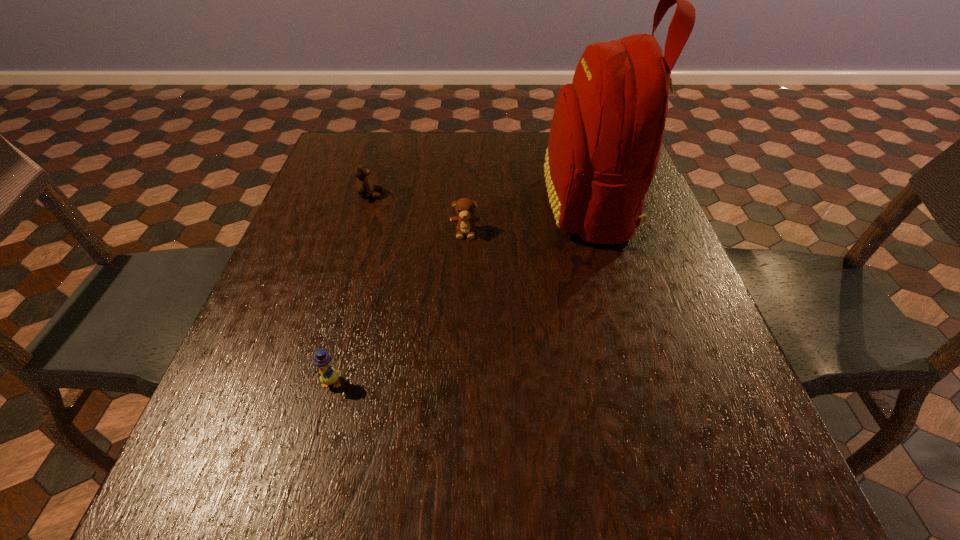
Where is `empty location between the second object from right to left and the rightmost object`? The height and width of the screenshot is (540, 960). empty location between the second object from right to left and the rightmost object is located at coordinates (527, 218).

The image size is (960, 540). In order to click on vacant space that is in between the nearest object and the left teddy bear in this screenshot , I will do `click(350, 288)`.

Locate an element on the screen. This screenshot has width=960, height=540. free spot between the rightmost object and the nearer teddy bear is located at coordinates (527, 218).

The width and height of the screenshot is (960, 540). I want to click on free space between the duckling and the second object from right to left, so click(398, 307).

Find the location of a particular element. The width and height of the screenshot is (960, 540). free space between the farther teddy bear and the nearest object is located at coordinates (350, 288).

You are a GUI agent. You are given a task and a screenshot of the screen. Output one action in this format:
    pyautogui.click(x=<x>, y=<y>)
    Task: Click on the empty space between the backpack and the third object from left to right
    This screenshot has width=960, height=540.
    Given the screenshot: What is the action you would take?
    pyautogui.click(x=527, y=218)

This screenshot has width=960, height=540. In order to click on vacant region between the left teddy bear and the rightmost object in this screenshot , I will do `click(479, 199)`.

This screenshot has width=960, height=540. Find the location of `empty space that is in between the farther teddy bear and the tallest object`. empty space that is in between the farther teddy bear and the tallest object is located at coordinates (479, 199).

This screenshot has width=960, height=540. I want to click on free space between the duckling and the right teddy bear, so click(398, 307).

In order to click on free spot between the right teddy bear and the farther teddy bear in this screenshot , I will do `click(419, 213)`.